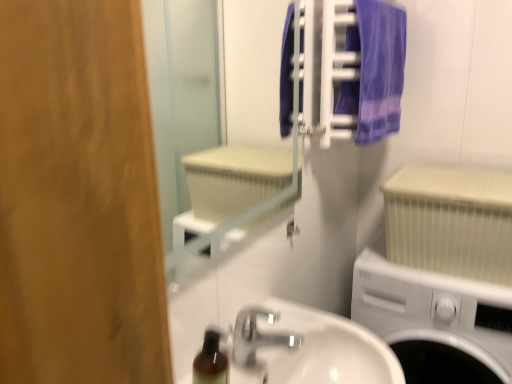
Question: Can you confirm if white textured mirror at upper center is smaller than purple fabric towel at upper right?

Choices:
 (A) no
 (B) yes

Answer: (B)

Question: From the image's perspective, is white textured mirror at upper center on purple fabric towel at upper right?

Choices:
 (A) yes
 (B) no

Answer: (B)

Question: Considering the relative positions of white textured mirror at upper center and purple fabric towel at upper right in the image provided, is white textured mirror at upper center to the right of purple fabric towel at upper right from the viewer's perspective?

Choices:
 (A) no
 (B) yes

Answer: (A)

Question: Can you confirm if white textured mirror at upper center is taller than purple fabric towel at upper right?

Choices:
 (A) yes
 (B) no

Answer: (A)

Question: From the image's perspective, is white textured mirror at upper center beneath purple fabric towel at upper right?

Choices:
 (A) yes
 (B) no

Answer: (A)

Question: Considering the relative sizes of white textured mirror at upper center and purple fabric towel at upper right in the image provided, is white textured mirror at upper center wider than purple fabric towel at upper right?

Choices:
 (A) yes
 (B) no

Answer: (B)

Question: From a real-world perspective, is purple fabric towel at upper right over white plastic washing machine at lower right?

Choices:
 (A) no
 (B) yes

Answer: (B)

Question: Would you say white plastic washing machine at lower right is part of purple fabric towel at upper right's contents?

Choices:
 (A) yes
 (B) no

Answer: (B)

Question: Would you say purple fabric towel at upper right is outside white plastic washing machine at lower right?

Choices:
 (A) yes
 (B) no

Answer: (A)

Question: Is the position of purple fabric towel at upper right more distant than that of white plastic washing machine at lower right?

Choices:
 (A) yes
 (B) no

Answer: (B)

Question: Does purple fabric towel at upper right appear on the right side of white plastic washing machine at lower right?

Choices:
 (A) yes
 (B) no

Answer: (B)

Question: Is purple fabric towel at upper right oriented towards white plastic washing machine at lower right?

Choices:
 (A) no
 (B) yes

Answer: (A)

Question: From the image's perspective, is silver metallic faucet at lower center over white textured mirror at upper center?

Choices:
 (A) no
 (B) yes

Answer: (A)